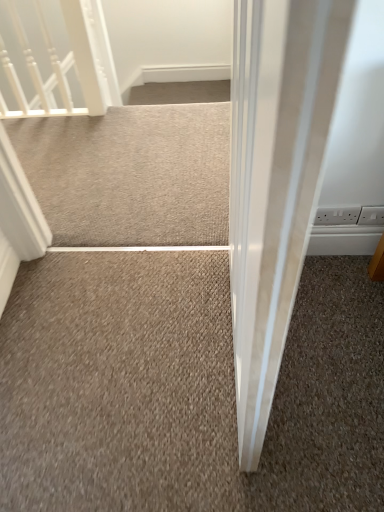
Question: From the image's perspective, would you say white plastic electric outlet at right, which is the 1th electric outlet from right to left, is shown under white glossy rail at upper left?

Choices:
 (A) yes
 (B) no

Answer: (A)

Question: Considering the relative positions of white plastic electric outlet at right, which is the 1th electric outlet from right to left, and white glossy rail at upper left in the image provided, is white plastic electric outlet at right, which is the 1th electric outlet from right to left, to the left of white glossy rail at upper left from the viewer's perspective?

Choices:
 (A) no
 (B) yes

Answer: (A)

Question: From a real-world perspective, is white plastic electric outlet at right, the 2th electric outlet from the left, under white glossy rail at upper left?

Choices:
 (A) no
 (B) yes

Answer: (B)

Question: Is white glossy rail at upper left located within white plastic electric outlet at right, the 2th electric outlet from the left?

Choices:
 (A) no
 (B) yes

Answer: (A)

Question: Is the depth of white plastic electric outlet at right, the 2th electric outlet from the left, greater than that of white glossy rail at upper left?

Choices:
 (A) yes
 (B) no

Answer: (B)

Question: From the image's perspective, is white plastic electric outlet at right, the 2th electric outlet from the left, located above white glossy rail at upper left?

Choices:
 (A) no
 (B) yes

Answer: (A)

Question: Does white glossy rail at upper left appear on the left side of white plastic electric outlet at upper right, which ranks as the 2th electric outlet in right-to-left order?

Choices:
 (A) yes
 (B) no

Answer: (A)

Question: Is white glossy rail at upper left positioned in front of white plastic electric outlet at upper right, which ranks as the 2th electric outlet in right-to-left order?

Choices:
 (A) yes
 (B) no

Answer: (B)

Question: Is white glossy rail at upper left oriented towards white plastic electric outlet at upper right, acting as the first electric outlet starting from the left?

Choices:
 (A) yes
 (B) no

Answer: (B)

Question: Is white glossy rail at upper left thinner than white plastic electric outlet at upper right, acting as the first electric outlet starting from the left?

Choices:
 (A) no
 (B) yes

Answer: (A)

Question: From the image's perspective, does white glossy rail at upper left appear lower than white plastic electric outlet at upper right, which ranks as the 2th electric outlet in right-to-left order?

Choices:
 (A) no
 (B) yes

Answer: (A)

Question: From the image's perspective, is white glossy rail at upper left above white plastic electric outlet at upper right, which ranks as the 2th electric outlet in right-to-left order?

Choices:
 (A) no
 (B) yes

Answer: (B)

Question: Does beige carpet at center have a greater width compared to white plastic electric outlet at upper right, acting as the first electric outlet starting from the left?

Choices:
 (A) no
 (B) yes

Answer: (B)